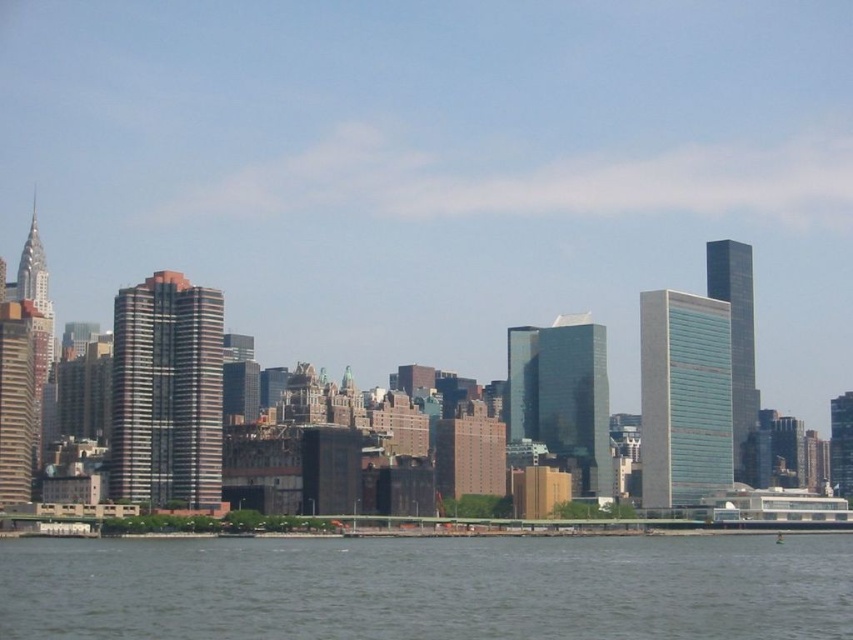
You are standing on a dock and see the gray water at lower center and the white glossy boat at lower right. Which object is closer to your right side?

The white glossy boat at lower right is closer to your right side because it is positioned to the right of the gray water at lower center.

You are standing on a pier and want to take a photo of the white glossy boat at lower right without the gray water at lower center blocking the view. How should you adjust your position?

Move backward to position yourself so the white glossy boat at lower right is no longer behind the gray water at lower center.